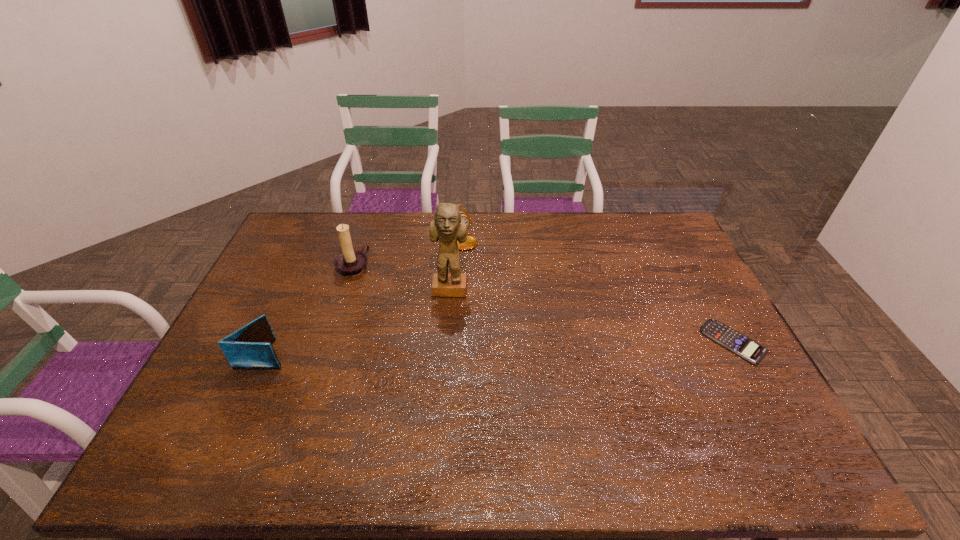
The image size is (960, 540). Find the location of `free space on the desktop that is between the second shortest object and the calculator and is positioned on the face of the pocket watch`. free space on the desktop that is between the second shortest object and the calculator and is positioned on the face of the pocket watch is located at coordinates (557, 346).

You are a GUI agent. You are given a task and a screenshot of the screen. Output one action in this format:
    pyautogui.click(x=<x>, y=<y>)
    Task: Click on the vacant space on the desktop that is between the fourth tallest object and the shortest object and is positioned on the wick of the fourth object from right to left
    
    Given the screenshot: What is the action you would take?
    pyautogui.click(x=532, y=347)

The image size is (960, 540). Find the location of `free spot on the desktop that is between the fourth tallest object and the shortest object and is positioned on the front-facing side of the tallest object`. free spot on the desktop that is between the fourth tallest object and the shortest object and is positioned on the front-facing side of the tallest object is located at coordinates (446, 349).